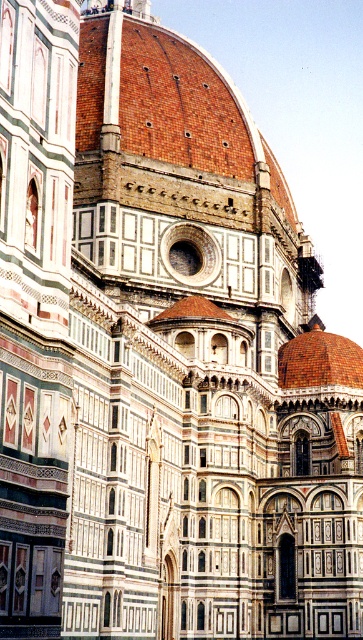
Question: Considering the relative positions of terracotta brick dome at center and brown tiled dome at center in the image provided, where is terracotta brick dome at center located with respect to brown tiled dome at center?

Choices:
 (A) below
 (B) above

Answer: (B)

Question: From the image, what is the correct spatial relationship of terracotta brick dome at center in relation to brown tiled dome at center?

Choices:
 (A) below
 (B) above

Answer: (B)

Question: Among these points, which one is farthest from the camera?

Choices:
 (A) (132, 129)
 (B) (286, 365)

Answer: (B)

Question: Is terracotta brick dome at center to the left of brown tiled dome at center from the viewer's perspective?

Choices:
 (A) no
 (B) yes

Answer: (B)

Question: Which object appears farthest from the camera in this image?

Choices:
 (A) terracotta brick dome at center
 (B) brown tiled dome at center

Answer: (A)